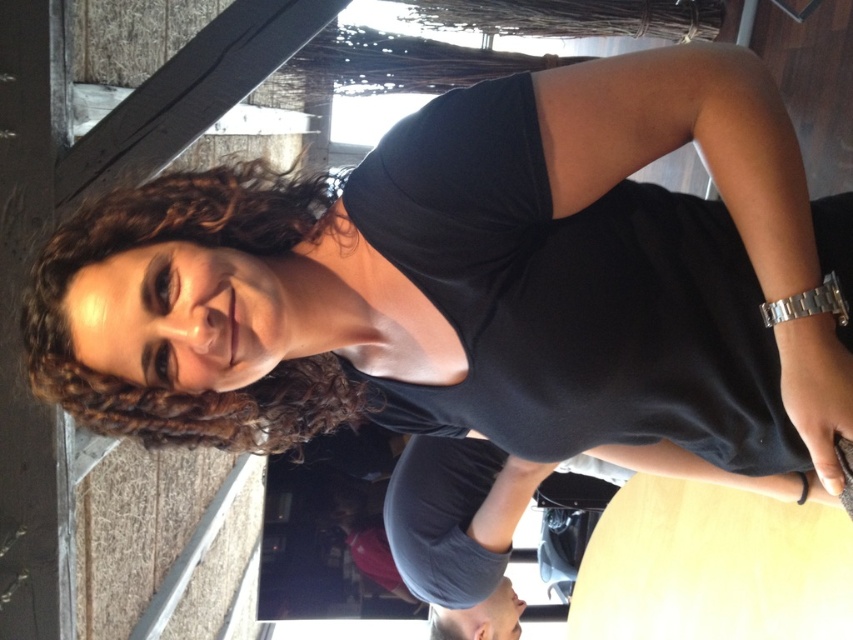
You are a photographer setting up a camera 10 inches away from the black matte dress at center. Can you also capture the curly brown hair at upper left in the same frame without moving the camera?

The distance between the black matte dress at center and the curly brown hair at upper left is 9.68 inches. Since the camera is set 10 inches away from the dress, the hair is within the camera frame range, so yes, it can be captured without moving the camera.

You are a fashion designer observing a model wearing the black matte dress at center and curly brown hair at upper left. Which of the two is taller?

The black matte dress at center is much taller than the curly brown hair at upper left.

You are an interior designer planning to place a new sofa in a room similar to the scene. The sofa must be positioned exactly where the black matte dress at center is currently located. What are the coordinates of the point where the sofa should be placed?

The coordinates for placing the sofa should be at point (573, 282), as that is the exact location of the black matte dress at center in the scene.